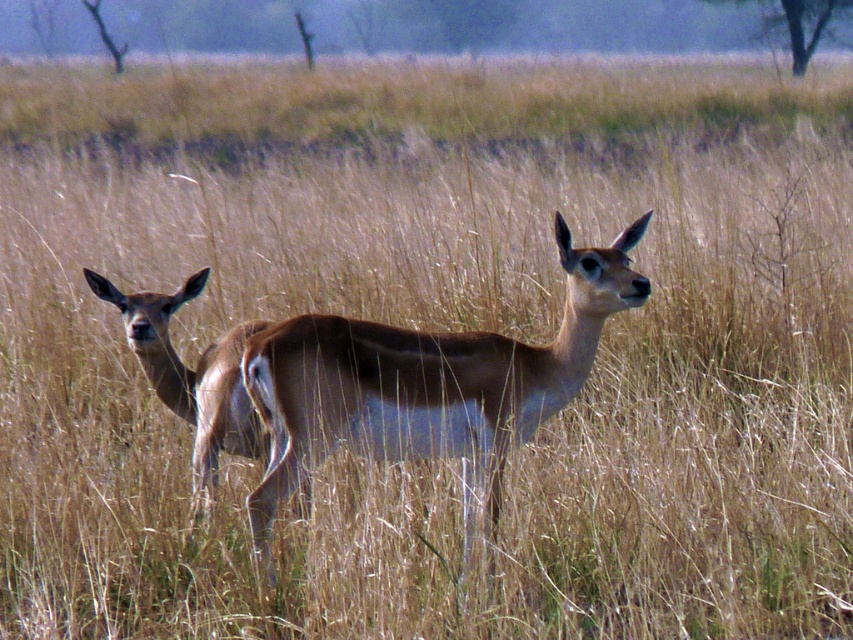
Is the position of brown glossy deer at center more distant than that of brown glossy deer at left?

No, brown glossy deer at center is closer to the viewer.

Does point (480, 413) lie in front of point (252, 451)?

Yes, point (480, 413) is in front of point (252, 451).

Who is more forward, (532, 417) or (262, 438)?

Point (532, 417) is in front.

Where is `brown glossy deer at center`? The image size is (853, 640). brown glossy deer at center is located at coordinates (427, 385).